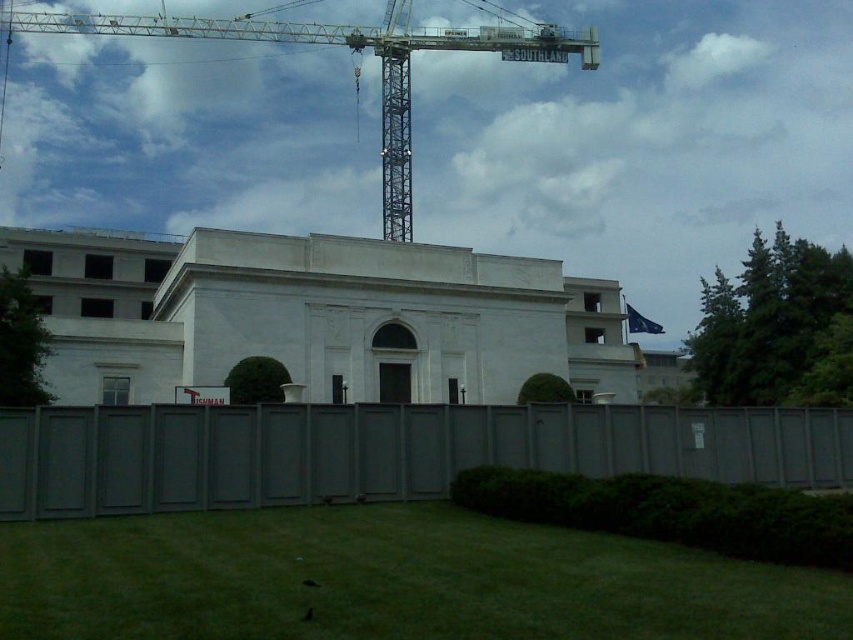
Question: Observing the image, what is the correct spatial positioning of gray wood fence at lower center in reference to metallic gray crane at upper center?

Choices:
 (A) left
 (B) right

Answer: (B)

Question: Can you confirm if gray wood fence at lower center is wider than metallic gray crane at upper center?

Choices:
 (A) yes
 (B) no

Answer: (B)

Question: Which of the following is the closest to the observer?

Choices:
 (A) gray wood fence at lower center
 (B) metallic gray crane at upper center

Answer: (A)

Question: Can you confirm if gray wood fence at lower center is positioned to the right of metallic gray crane at upper center?

Choices:
 (A) no
 (B) yes

Answer: (B)